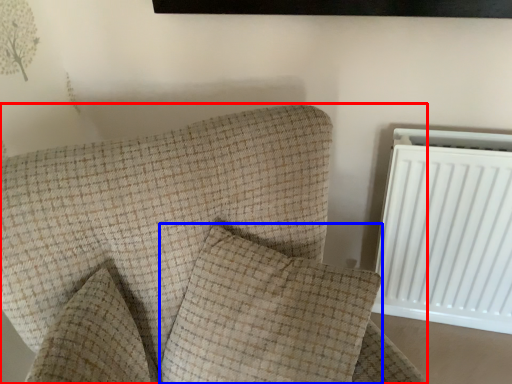
Question: Which object appears farthest to the camera in this image, furniture (highlighted by a red box) or pillow (highlighted by a blue box)?

Choices:
 (A) furniture
 (B) pillow

Answer: (B)